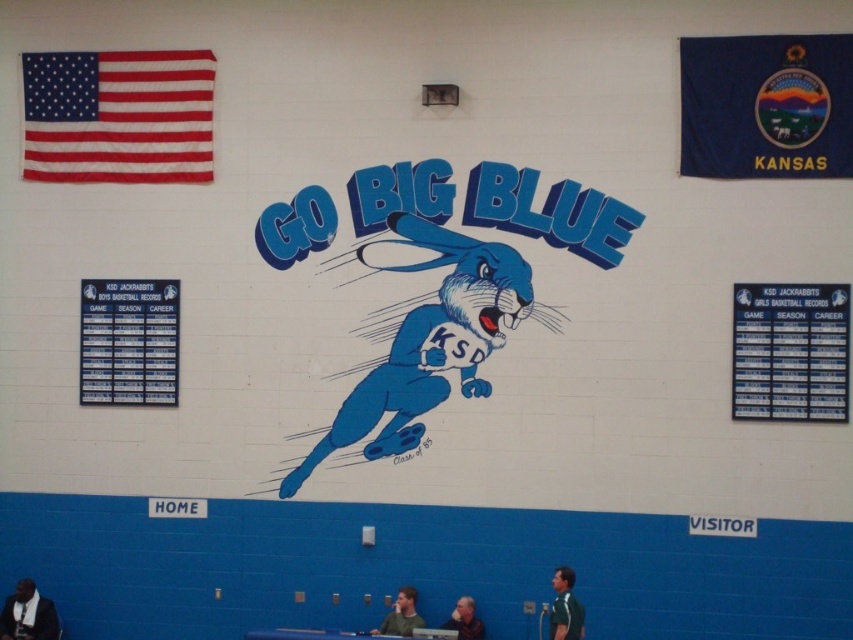
Who is shorter, textured fabric flag at upper left or blue plastic scoreboard at left?

With less height is blue plastic scoreboard at left.

Is point (100, 109) positioned behind point (161, 282)?

Yes, it is behind point (161, 282).

This screenshot has height=640, width=853. I want to click on textured fabric flag at upper left, so click(119, 116).

Image resolution: width=853 pixels, height=640 pixels. In order to click on textured fabric flag at upper left in this screenshot , I will do `click(119, 116)`.

Which is behind, point (837, 132) or point (80, 77)?

Positioned behind is point (80, 77).

Can you confirm if blue fabric kansas flag at upper right is positioned above textured fabric flag at upper left?

No, blue fabric kansas flag at upper right is not above textured fabric flag at upper left.

Find the location of `blue fabric kansas flag at upper right`. blue fabric kansas flag at upper right is located at coordinates (766, 106).

Does blue plastic scoreboard at left have a lesser height compared to dark blue shirt at lower left?

No, blue plastic scoreboard at left is not shorter than dark blue shirt at lower left.

Is blue plastic scoreboard at left bigger than dark blue shirt at lower left?

Yes, blue plastic scoreboard at left is bigger than dark blue shirt at lower left.

You are a GUI agent. You are given a task and a screenshot of the screen. Output one action in this format:
    pyautogui.click(x=<x>, y=<y>)
    Task: Click on the blue plastic scoreboard at left
    This screenshot has height=640, width=853.
    Given the screenshot: What is the action you would take?
    pyautogui.click(x=128, y=340)

Locate an element on the screen. blue plastic scoreboard at left is located at coordinates click(128, 340).